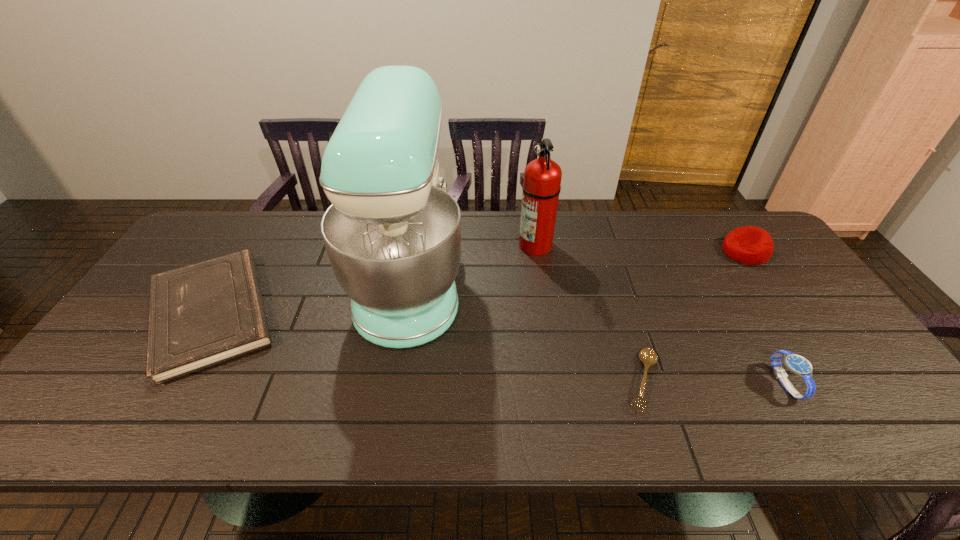
Locate an element on the screen. Image resolution: width=960 pixels, height=540 pixels. mixer is located at coordinates (392, 234).

The width and height of the screenshot is (960, 540). What are the coordinates of `the tallest object` in the screenshot? It's located at (392, 234).

This screenshot has width=960, height=540. I want to click on the second tallest object, so click(541, 187).

The height and width of the screenshot is (540, 960). I want to click on fire extinguisher, so click(541, 187).

The height and width of the screenshot is (540, 960). I want to click on the rightmost object, so click(750, 245).

You are a GUI agent. You are given a task and a screenshot of the screen. Output one action in this format:
    pyautogui.click(x=<x>, y=<y>)
    Task: Click on the watch
    
    Given the screenshot: What is the action you would take?
    pyautogui.click(x=797, y=364)

Identify the location of paperback book. (206, 313).

Where is `the fifth tallest object`? the fifth tallest object is located at coordinates (206, 313).

I want to click on ladle, so click(648, 356).

This screenshot has width=960, height=540. Find the location of `the third object from right to left`. the third object from right to left is located at coordinates (648, 356).